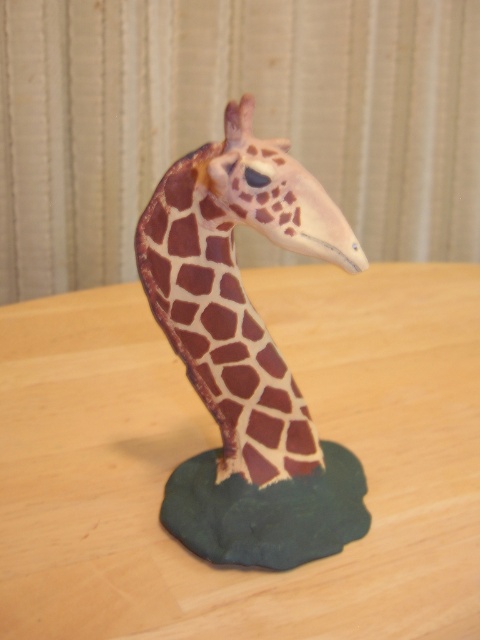
You are an art restorer examining the giraffe figurine. You notice two specific points on the figurine. One is at coordinate point (x=47, y=436) and the other at point (x=137, y=240). Which point is closer to you when observing the figurine from the front?

Point (x=47, y=436) is closer to you than point (x=137, y=240) because it is further to the viewer according to the description.

You are a small toy car that wants to move from the giraffe figurine to the wooden table at center. The coordinates of the wooden table at center are given as point (x=219, y=444). Can you reach the wooden table at center without any obstacles?

The wooden table at center is represented by point (x=219, y=444), so yes, you can reach it as there are no obstacles mentioned in the scene description.